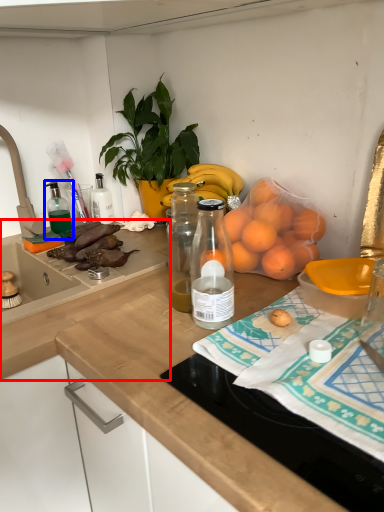
Question: Which object is closer to the camera taking this photo, countertop (highlighted by a red box) or bottle (highlighted by a blue box)?

Choices:
 (A) countertop
 (B) bottle

Answer: (A)